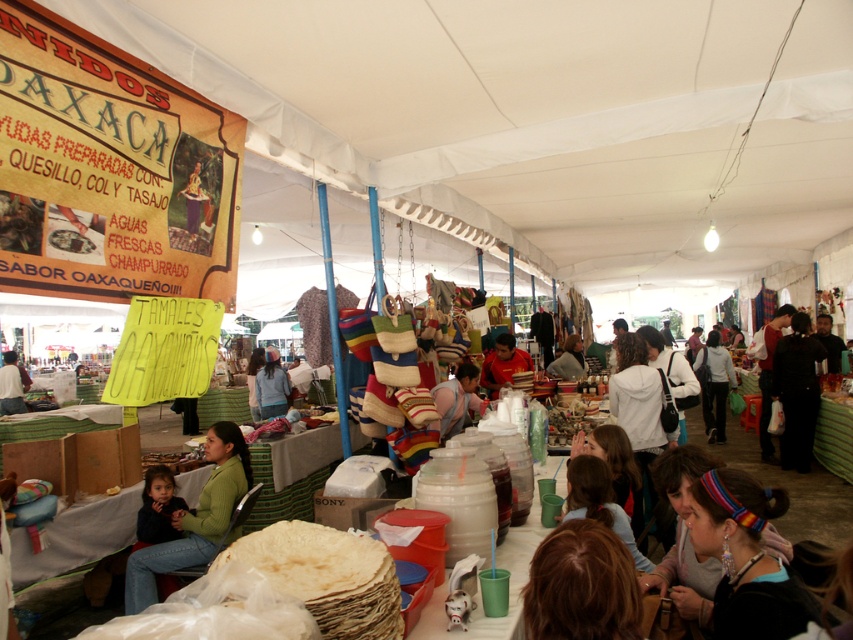
You are standing at the entrance of the market under the large white tent. You want to locate the matte paper signboard at upper left. According to the coordinates given, where exactly is it positioned?

The matte paper signboard at upper left is located at point 0.267 along the x axis and 0.129 along the y axis.

You are a shopper standing at the entrance of the market under the large white tent. You see two points marked in the scene. The first point is at coordinates point [219,484], and the second is at point [525,364]. Which point is closer to you as you face the market?

Point [219,484] is in front of point [525,364], so it is closer to you as you face the market.

What is the spatial relationship between the matte paper signboard at upper left and the black matte pants at lower right in the market scene?

The matte paper signboard at upper left is positioned above the black matte pants at lower right.